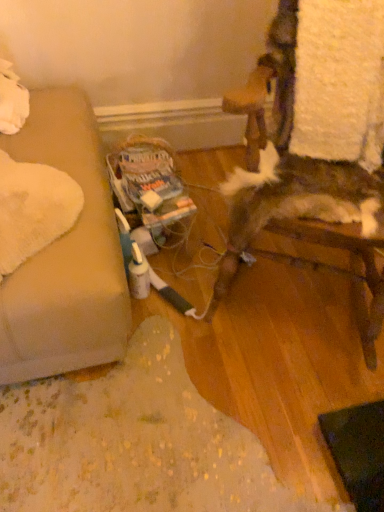
The image size is (384, 512). I want to click on wooden chair at center, so click(302, 188).

What do you see at coordinates (302, 188) in the screenshot? This screenshot has width=384, height=512. I see `wooden chair at center` at bounding box center [302, 188].

The width and height of the screenshot is (384, 512). I want to click on wooden chair at center, so click(x=302, y=188).